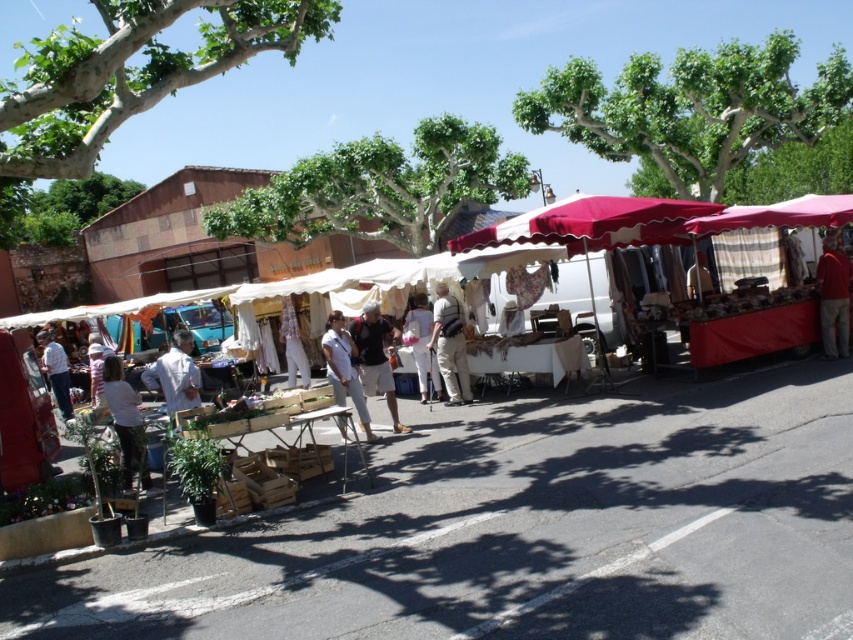
You are standing at the market and want to find a specific item. You see two points marked in the image. Which point is closer to you, point (329, 314) or point (421, 362)?

Point (421, 362) is closer to you because point (329, 314) is behind it.

You are standing at the point with coordinates point (463, 346) and want to walk towards the point with coordinates point (315, 330). Are you moving forward or backward?

Since point (315, 330) is behind point (463, 346), moving towards it would mean you are moving backward.